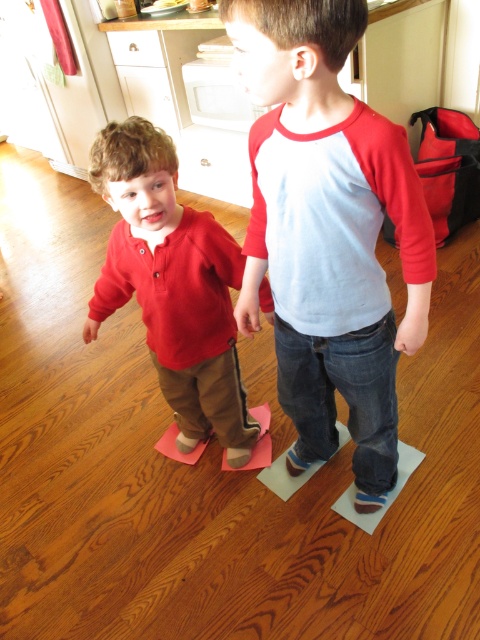
You are trying to decide which red clothing item to take for a costume party. Both the matte red shirt at center and the matte red sweater at left are available. Which one should you choose if you want the bigger size?

The matte red shirt at center is larger in size than the matte red sweater at left, so you should choose the matte red shirt at center for the bigger size.

You are a photographer trying to capture a photo of both children standing on their respective pieces of paper. The papers are marked with two points, point [292,228] and point [142,205]. Which point should you focus on first to ensure both children are in sharp focus?

You should focus on point [292,228] first because it is closer to the camera than point [142,205], ensuring both children are in focus when using a shallow depth of field.